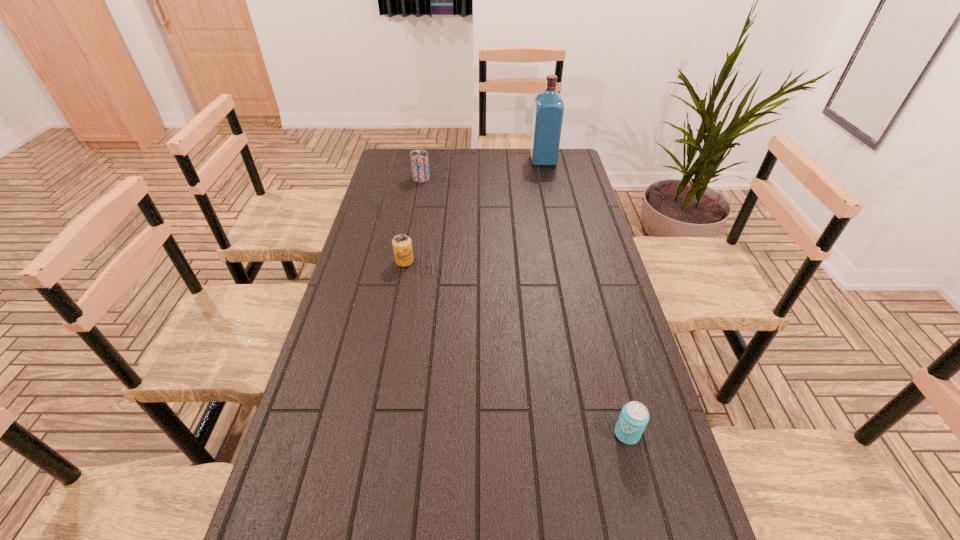
This screenshot has height=540, width=960. Find the location of `vacant space that satisfies the following two spatial constraints: 1. on the flat label side of the tallest object; 2. on the front side of the third farthest object`. vacant space that satisfies the following two spatial constraints: 1. on the flat label side of the tallest object; 2. on the front side of the third farthest object is located at coordinates (564, 261).

Locate an element on the screen. The width and height of the screenshot is (960, 540). vacant space that satisfies the following two spatial constraints: 1. on the flat label side of the tallest object; 2. on the left side of the rightmost beer can is located at coordinates (602, 434).

This screenshot has width=960, height=540. Identify the location of free location that satisfies the following two spatial constraints: 1. on the front side of the rightmost beer can; 2. on the right side of the second nearest object. (372, 434).